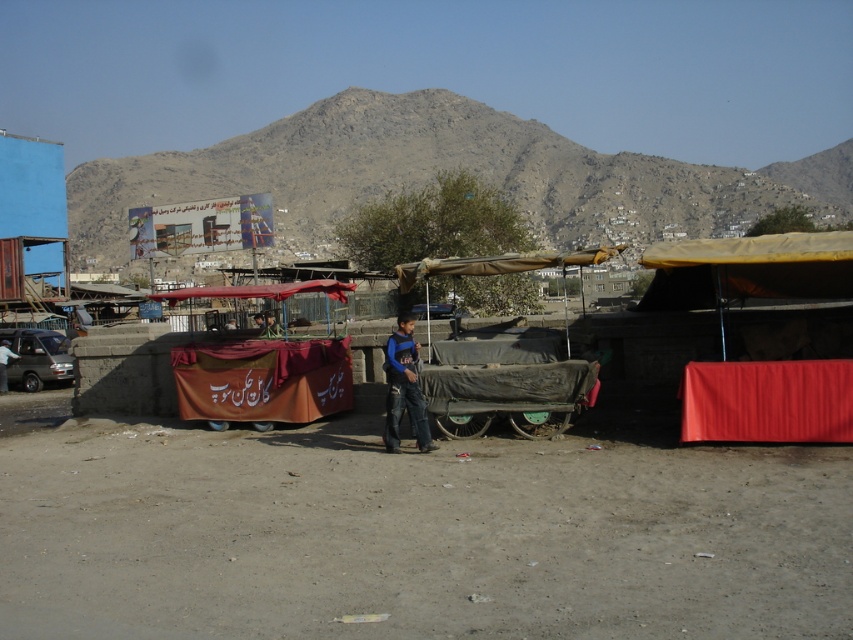
You are a delivery driver trying to navigate through the market. You see the metallic gray van at left and the gray rocky mountain at upper center. Which one is closer to you from your current position?

The metallic gray van at left is behind the gray rocky mountain at upper center, so the mountain is closer to you than the van.

You are a traveler standing at the market entrance and want to take a photo of the gray rocky mountain at upper center and the blue matte shirt at center. Can you frame both in the same shot without moving your camera position?

The gray rocky mountain at upper center is located above the blue matte shirt at center, so you can frame both in the same shot by adjusting the camera angle to include the mountain above and the shirt below without moving the camera position.